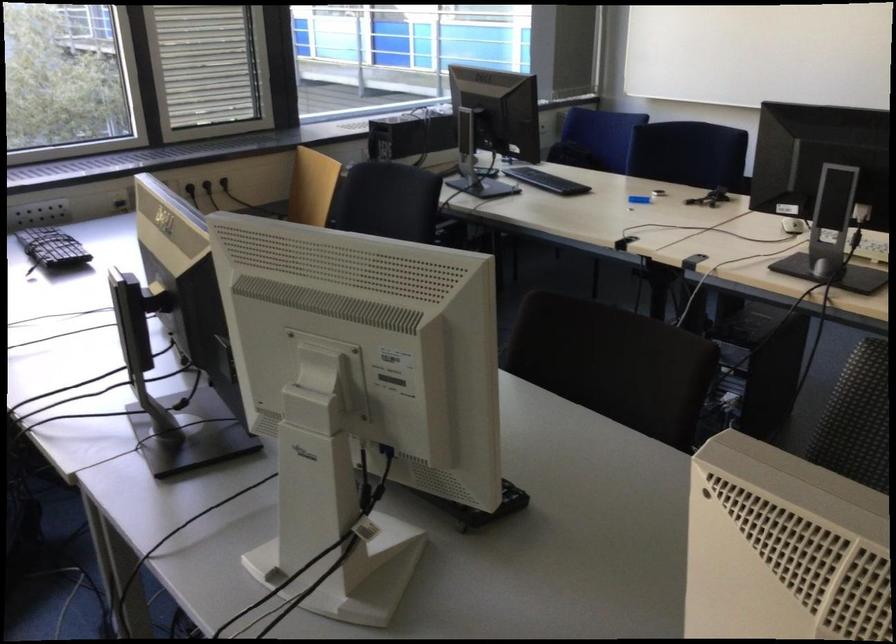
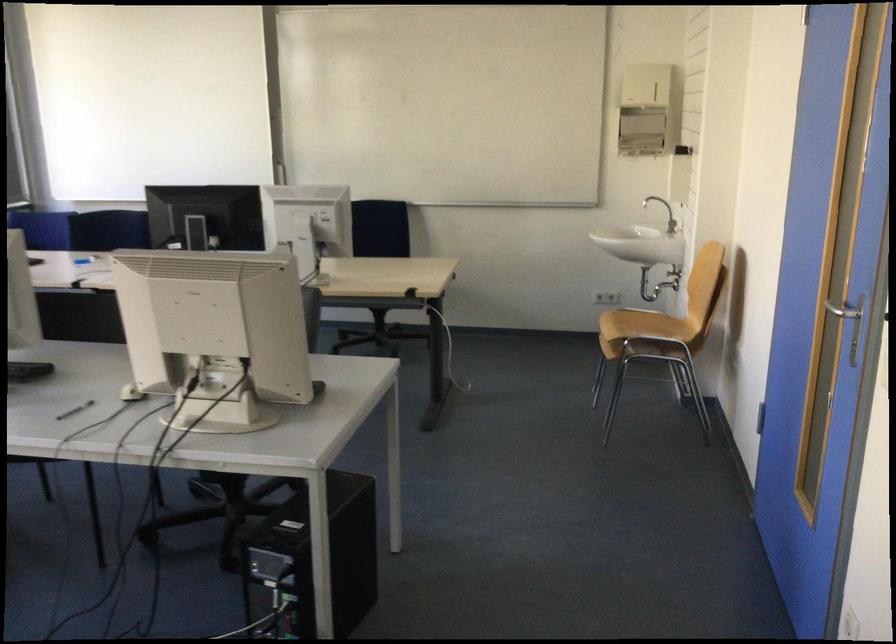
Question: I am providing you with two images of the same scene from different viewpoints. After the viewpoint changes to image2, which objects are now occluded?

Choices:
 (A) sink faucet handle
 (B) white network socket
 (C) black pen
 (D) blue chair sitting surface

Answer: (D)